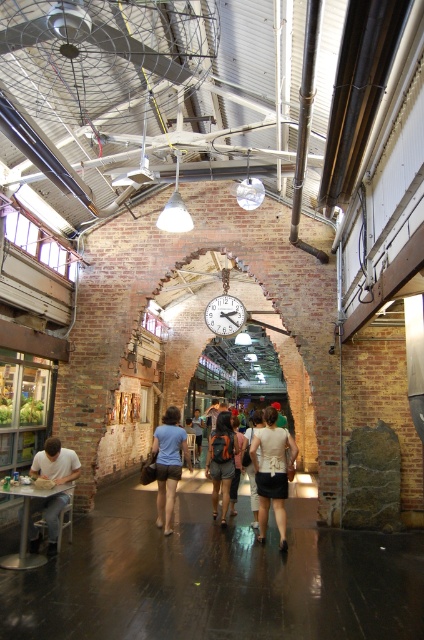
You are standing at the entrance of this industrial market space and notice a matte white shirt at lower left. If you want to walk directly towards it, what direction should you move in?

Since the matte white shirt at lower left is located at coordinates point (55, 461), you should move towards the lower left direction to reach it.

You are a delivery person carrying a package that requires a 6 feet clearance to pass through. You need to move from the matte white shirt at lower left to the blue denim shorts at center. Can you pass through the space between them without tilting the package?

The distance between the matte white shirt at lower left and blue denim shorts at center is 6.44 feet, which is more than the required 6 feet clearance. Therefore, you can pass through the space between them without tilting the package.